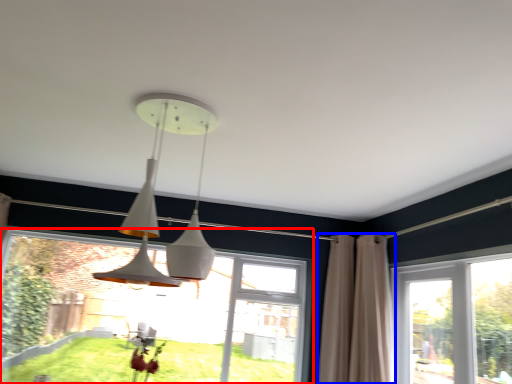
Question: Which object appears closest to the camera in this image, window (highlighted by a red box) or curtain (highlighted by a blue box)?

Choices:
 (A) window
 (B) curtain

Answer: (B)